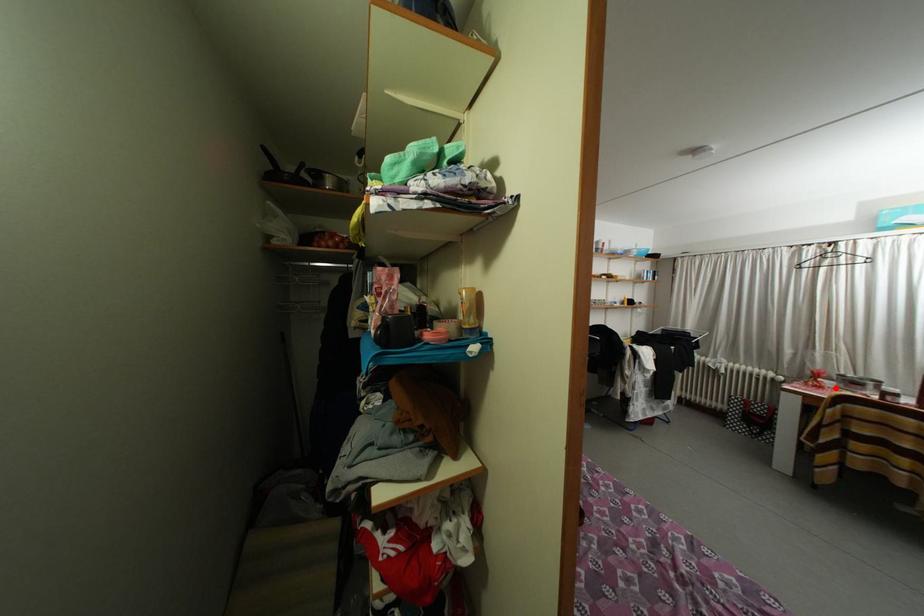
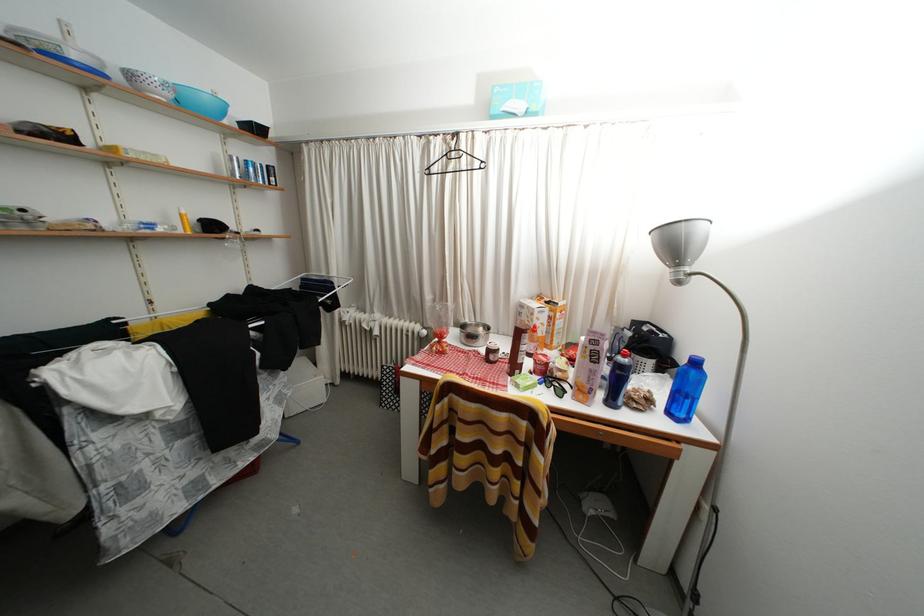
The point at the highlighted location is marked in the first image. Where is the corresponding point in the second image?

(460, 342)